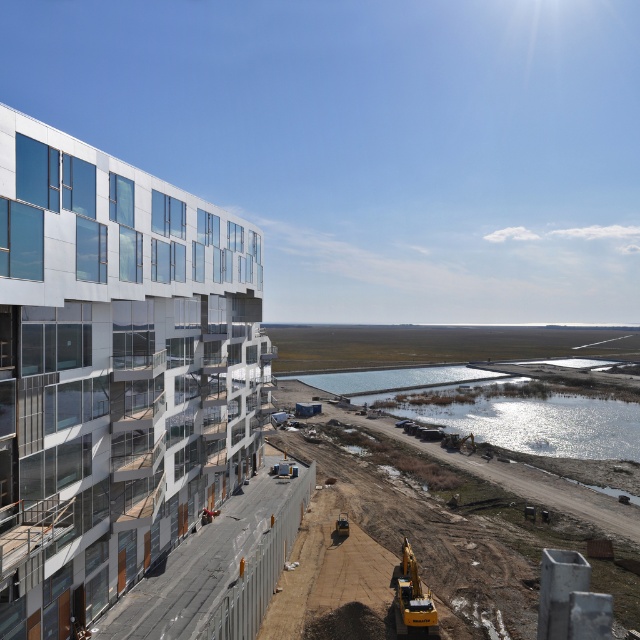
Question: Is shiny reflective water at lower center bigger than yellow metallic excavator at lower right?

Choices:
 (A) yes
 (B) no

Answer: (A)

Question: Which of these objects is positioned closest to the white glass building at upper left?

Choices:
 (A) shiny reflective water at lower center
 (B) yellow metallic excavator at lower right

Answer: (B)

Question: Which point appears closest to the camera in this image?

Choices:
 (A) (104, 289)
 (B) (456, 422)
 (C) (433, 608)

Answer: (A)

Question: Among these points, which one is farthest from the camera?

Choices:
 (A) (422, 609)
 (B) (170, 257)

Answer: (B)

Question: Can you confirm if white glass building at upper left is bigger than yellow metallic excavator at lower right?

Choices:
 (A) no
 (B) yes

Answer: (B)

Question: Can you confirm if white glass building at upper left is positioned below shiny reflective water at lower center?

Choices:
 (A) yes
 (B) no

Answer: (B)